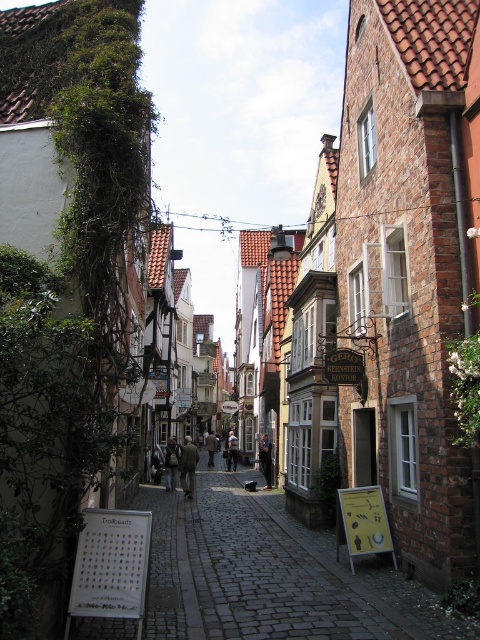
Is light brown leather jacket at center shorter than brown wool coat at center?

Correct, light brown leather jacket at center is not as tall as brown wool coat at center.

Which is more to the right, light brown leather jacket at center or brown wool coat at center?

From the viewer's perspective, light brown leather jacket at center appears more on the right side.

Between point (173, 442) and point (213, 452), which one is positioned in front?

Positioned in front is point (173, 442).

Where is `light brown leather jacket at center`? light brown leather jacket at center is located at coordinates (171, 461).

Does dark cobblestone alley at center have a lesser width compared to brown wool coat at center?

No, dark cobblestone alley at center is not thinner than brown wool coat at center.

Can you confirm if dark cobblestone alley at center is positioned below brown wool coat at center?

No.

Who is more forward, (213, 486) or (213, 438)?

Point (213, 486) is in front.

This screenshot has height=640, width=480. What are the coordinates of `dark cobblestone alley at center` in the screenshot? It's located at (272, 573).

Does point (245, 604) lie behind point (228, 440)?

No, it is in front of (228, 440).

Describe the element at coordinates (272, 573) in the screenshot. Image resolution: width=480 pixels, height=640 pixels. I see `dark cobblestone alley at center` at that location.

Is point (369, 620) positioned before point (232, 452)?

Yes, point (369, 620) is closer to viewer.

The width and height of the screenshot is (480, 640). I want to click on dark cobblestone alley at center, so click(x=272, y=573).